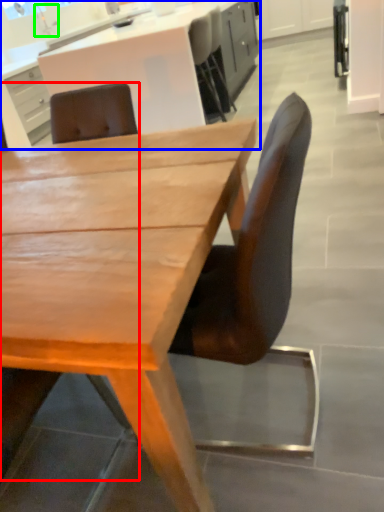
Question: Considering the real-world distances, which object is farthest from chair (highlighted by a red box)? cabinetry (highlighted by a blue box) or faucet (highlighted by a green box)?

Choices:
 (A) cabinetry
 (B) faucet

Answer: (A)